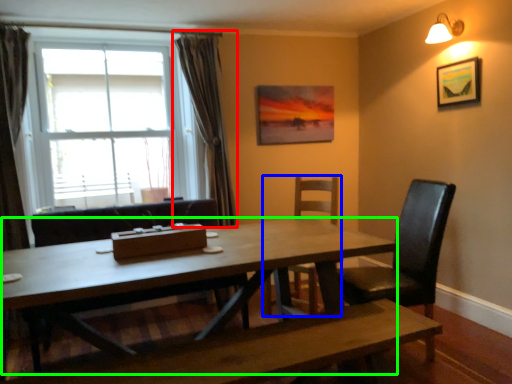
Question: Considering the real-world distances, which object is closest to curtain (highlighted by a red box)? chair (highlighted by a blue box) or kitchen & dining room table (highlighted by a green box).

Choices:
 (A) chair
 (B) kitchen & dining room table

Answer: (A)